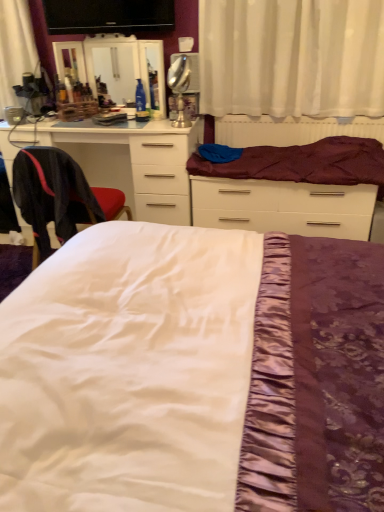
Question: Relative to white satin bed at center, which is counted as the second bed, starting from the back, is black glossy flat-screen tv at upper center in front or behind?

Choices:
 (A) front
 (B) behind

Answer: (B)

Question: From the image's perspective, is black glossy flat-screen tv at upper center above or below white satin bed at center, marked as the first bed in a front-to-back arrangement?

Choices:
 (A) above
 (B) below

Answer: (A)

Question: Which is farther from the white satin bed at center, marked as the first bed in a front-to-back arrangement?

Choices:
 (A) black glossy flat-screen tv at upper center
 (B) black fabric chair at left
 (C) silver metallic table lamp at upper center
 (D) purple satin bed at center, which ranks as the second bed in front-to-back order
 (E) white sheer curtain at upper center

Answer: (A)

Question: Based on their relative distances, which object is farther from the purple satin bed at center, which ranks as the second bed in front-to-back order?

Choices:
 (A) black glossy flat-screen tv at upper center
 (B) silver metallic table lamp at upper center
 (C) white glossy chest of drawers at left
 (D) white satin bed at center, marked as the first bed in a front-to-back arrangement
 (E) white sheer curtain at upper center

Answer: (D)